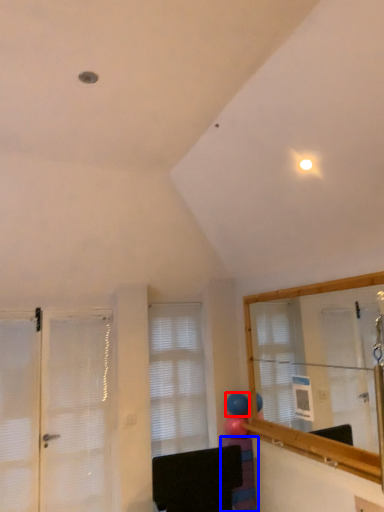
Question: Which of the following is the closest to the observer, balloon (highlighted by a red box) or furniture (highlighted by a blue box)?

Choices:
 (A) balloon
 (B) furniture

Answer: (B)